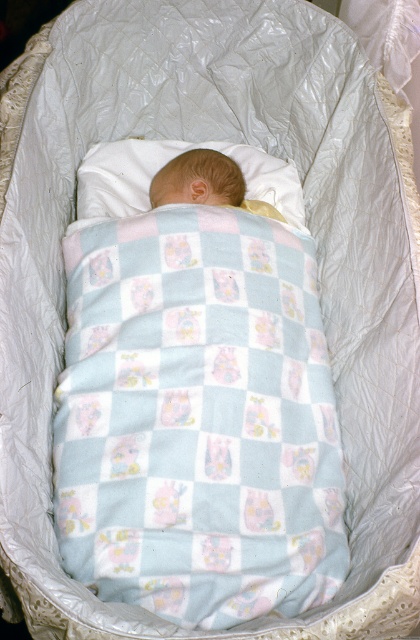
Between white soft pillow at center and light blue soft fabric newborn at center, which one has less height?

light blue soft fabric newborn at center is shorter.

Is point (76, 221) positioned after point (196, 182)?

No, it is in front of (196, 182).

Is point (252, 164) farther from viewer compared to point (233, 170)?

Yes, it is behind point (233, 170).

Locate an element on the screen. white soft pillow at center is located at coordinates (163, 164).

Who is lower down, light blue flannel blanket at center or light blue soft fabric newborn at center?

light blue flannel blanket at center

Which is above, light blue flannel blanket at center or light blue soft fabric newborn at center?

Positioned higher is light blue soft fabric newborn at center.

Is point (175, 243) positioned in front of point (215, 186)?

Yes, point (175, 243) is in front of point (215, 186).

You are a GUI agent. You are given a task and a screenshot of the screen. Output one action in this format:
    pyautogui.click(x=<x>, y=<y>)
    Task: Click on the light blue flannel blanket at center
    
    Given the screenshot: What is the action you would take?
    pyautogui.click(x=197, y=419)

Can you confirm if light blue flannel blanket at center is positioned above white soft pillow at center?

Incorrect, light blue flannel blanket at center is not positioned above white soft pillow at center.

Can you confirm if light blue flannel blanket at center is shorter than white soft pillow at center?

No, light blue flannel blanket at center is not shorter than white soft pillow at center.

Who is more forward, (312, 516) or (105, 179)?

Point (312, 516) is more forward.

The height and width of the screenshot is (640, 420). In order to click on light blue flannel blanket at center in this screenshot , I will do `click(197, 419)`.